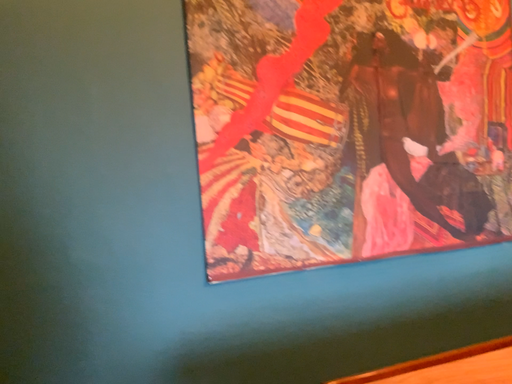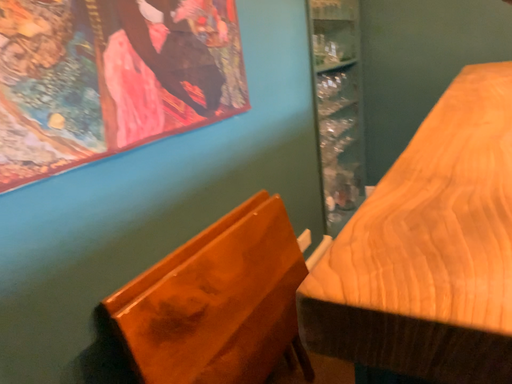
Question: How did the camera likely rotate when shooting the video?

Choices:
 (A) rotated upward
 (B) rotated downward

Answer: (B)